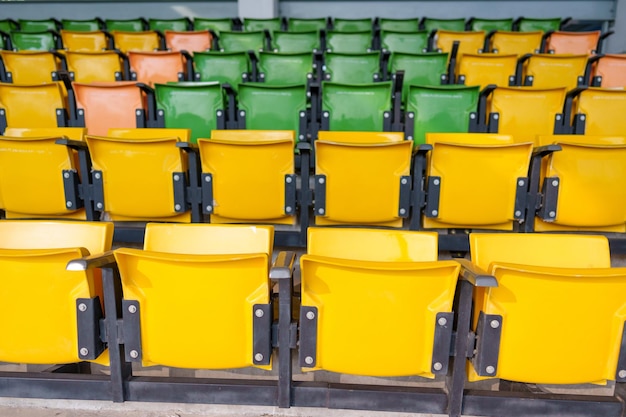
Where is `orange chairs`? orange chairs is located at coordinates (113, 102), (158, 73), (185, 43), (563, 44), (612, 72).